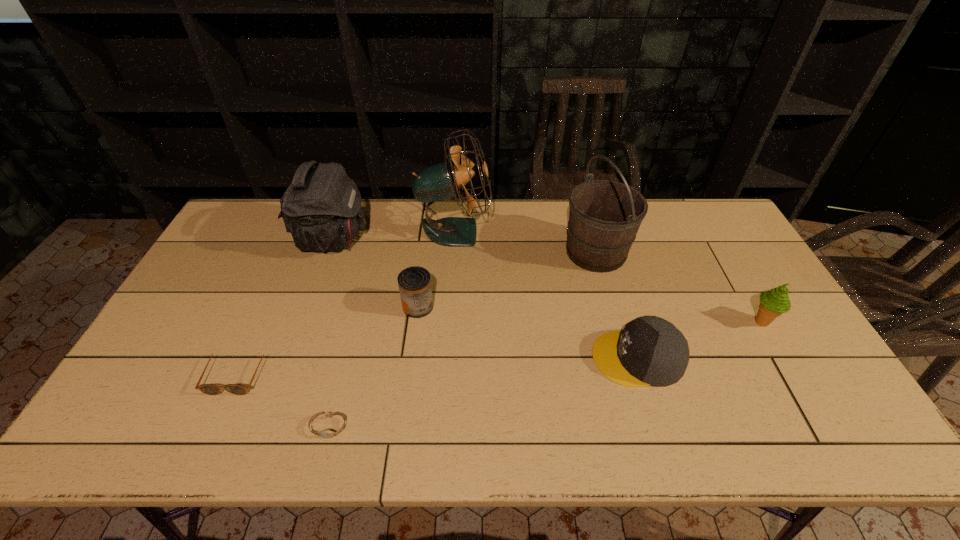
Where is `free space between the fan and the sunglasses`? The width and height of the screenshot is (960, 540). free space between the fan and the sunglasses is located at coordinates (346, 302).

You are a GUI agent. You are given a task and a screenshot of the screen. Output one action in this format:
    pyautogui.click(x=<x>, y=<y>)
    Task: Click on the vacant space that's between the can and the sunglasses
    
    Given the screenshot: What is the action you would take?
    pyautogui.click(x=327, y=339)

Find the location of `vacant point located between the nearest object and the fan`. vacant point located between the nearest object and the fan is located at coordinates (392, 329).

Locate an element on the screen. The height and width of the screenshot is (540, 960). free spot between the nearest object and the fifth shortest object is located at coordinates (544, 375).

Locate an element on the screen. The width and height of the screenshot is (960, 540). free point between the rightmost object and the shortest object is located at coordinates (544, 375).

Locate an element on the screen. The height and width of the screenshot is (540, 960). blank region between the nearest object and the sixth shortest object is located at coordinates tap(331, 333).

Where is `vacant area between the sunglasses and the can`? The image size is (960, 540). vacant area between the sunglasses and the can is located at coordinates (327, 339).

At what (x,y) coordinates should I click in order to perform the action: click on empty space between the fan and the nearest object. Please return your answer as a coordinate pair (x, y). The image size is (960, 540). Looking at the image, I should click on (392, 329).

In order to click on the third closest object to the bucket in this screenshot , I will do click(x=773, y=303).

Locate which object ranks in proximity to the watch. Please provide its 2D coordinates. Your answer should be formatted as a tuple, i.e. [(x, y)], where the tuple contains the x and y coordinates of a point satisfying the conditions above.

[(209, 389)]